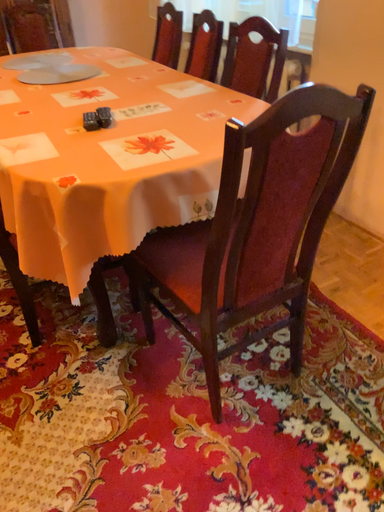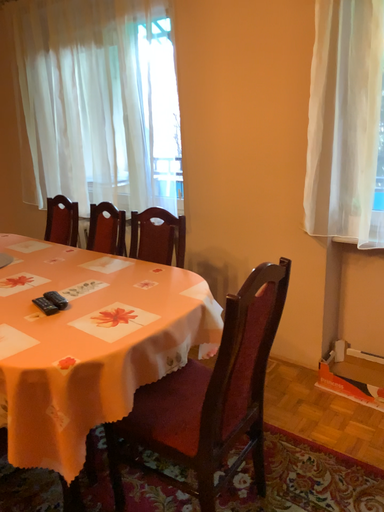
Question: How did the camera likely rotate when shooting the video?

Choices:
 (A) rotated right
 (B) rotated left

Answer: (A)